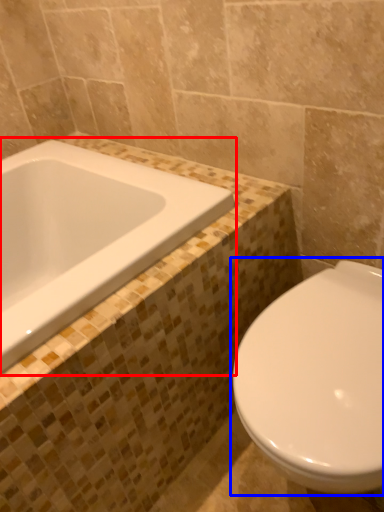
Question: Which object appears closest to the camera in this image, bathtub (highlighted by a red box) or toilet (highlighted by a blue box)?

Choices:
 (A) bathtub
 (B) toilet

Answer: (B)